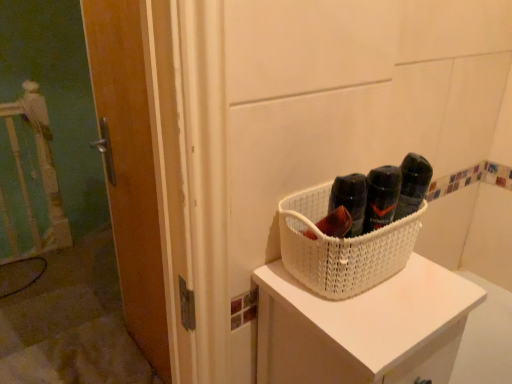
Question: Is wooden door at left wider than white woven basket at center?

Choices:
 (A) no
 (B) yes

Answer: (A)

Question: Is wooden door at left at the right side of white woven basket at center?

Choices:
 (A) yes
 (B) no

Answer: (B)

Question: From a real-world perspective, is wooden door at left on top of white woven basket at center?

Choices:
 (A) no
 (B) yes

Answer: (A)

Question: From a real-world perspective, does wooden door at left sit lower than white woven basket at center?

Choices:
 (A) yes
 (B) no

Answer: (A)

Question: Can you confirm if wooden door at left is taller than white woven basket at center?

Choices:
 (A) yes
 (B) no

Answer: (A)

Question: In terms of size, does white woven basket at center appear bigger or smaller than wooden door at left?

Choices:
 (A) small
 (B) big

Answer: (A)

Question: Would you say white woven basket at center is to the left or to the right of wooden door at left in the picture?

Choices:
 (A) left
 (B) right

Answer: (B)

Question: From the image's perspective, is white woven basket at center positioned above or below wooden door at left?

Choices:
 (A) below
 (B) above

Answer: (B)

Question: Does point (286, 253) appear closer or farther from the camera than point (119, 203)?

Choices:
 (A) farther
 (B) closer

Answer: (B)

Question: Is wooden door at left taller or shorter than white woven basket at upper right?

Choices:
 (A) tall
 (B) short

Answer: (A)

Question: In the image, is wooden door at left positioned in front of or behind white woven basket at upper right?

Choices:
 (A) behind
 (B) front

Answer: (A)

Question: From a real-world perspective, relative to white woven basket at upper right, is wooden door at left vertically above or below?

Choices:
 (A) below
 (B) above

Answer: (A)

Question: From the image's perspective, is wooden door at left above or below white woven basket at upper right?

Choices:
 (A) below
 (B) above

Answer: (B)

Question: From the image's perspective, relative to wooden door at left, is white woven basket at upper right above or below?

Choices:
 (A) below
 (B) above

Answer: (A)

Question: In terms of height, does white woven basket at upper right look taller or shorter compared to wooden door at left?

Choices:
 (A) short
 (B) tall

Answer: (A)